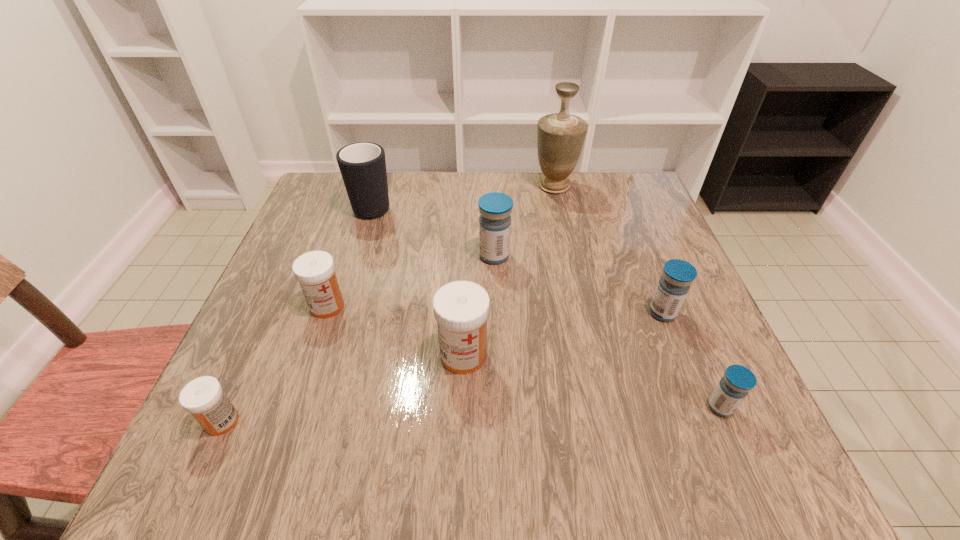
Identify the location of vacant space located on the right of the leftmost medicine. This screenshot has width=960, height=540. (444, 421).

You are a GUI agent. You are given a task and a screenshot of the screen. Output one action in this format:
    pyautogui.click(x=<x>, y=<y>)
    Task: Click on the urn at the far edge
    The height and width of the screenshot is (540, 960).
    Given the screenshot: What is the action you would take?
    pyautogui.click(x=560, y=136)

Image resolution: width=960 pixels, height=540 pixels. I want to click on mug positioned at the far edge, so click(x=362, y=165).

This screenshot has width=960, height=540. Identify the location of object positioned at the near edge. (203, 397).

This screenshot has height=540, width=960. I want to click on mug that is at the left edge, so click(362, 165).

At what (x,y) coordinates should I click in order to perform the action: click on object present at the far left corner. Please return your answer as a coordinate pair (x, y). Image resolution: width=960 pixels, height=540 pixels. Looking at the image, I should click on (362, 165).

You are a GUI agent. You are given a task and a screenshot of the screen. Output one action in this format:
    pyautogui.click(x=<x>, y=<y>)
    Task: Click on the object that is at the near left corner
    The image size is (960, 540).
    Given the screenshot: What is the action you would take?
    pyautogui.click(x=203, y=397)

Find the location of a particular element. vacant area at the far edge of the desktop is located at coordinates (419, 215).

Identify the location of vacant region at the near edge of the desktop. This screenshot has height=540, width=960. (653, 478).

Identify the location of vacant space at the left edge of the desktop. This screenshot has height=540, width=960. (240, 379).